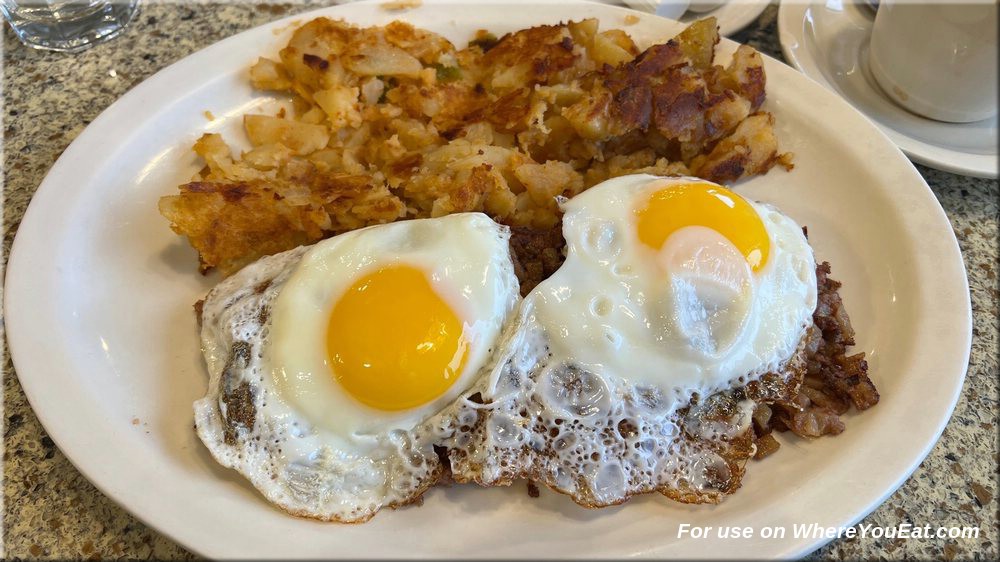
This screenshot has width=1000, height=562. In order to click on glass in this screenshot , I will do `click(84, 40)`.